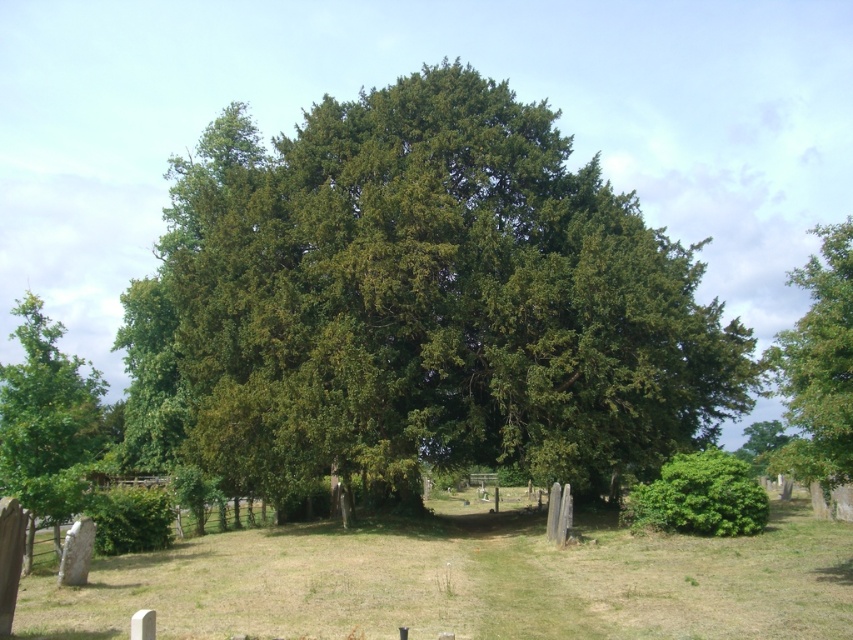
You are standing at the edge of the cemetery and want to walk towards the green grassy field at center. Which direction should you head?

The green grassy field at center is located at point [466,582], so you should head towards the center of the image to reach it.

You are standing in the cemetery scene and want to place a small statue exactly halfway between point (325, 189) and point (230, 632). Will the statue be closer to the camera or further away from it compared to the central tree?

The statue placed halfway between point (325, 189) and point (230, 632) will be closer to the camera than the central tree because point (325, 189) is further to the camera than point (230, 632), so the midpoint would be between them, but since one is closer and one is further, the average might be closer or further depending on the distance. Wait, the description says point (325, 189) is further to the camera than point (230, 632). So the midpoint between them would be somewhere between those,